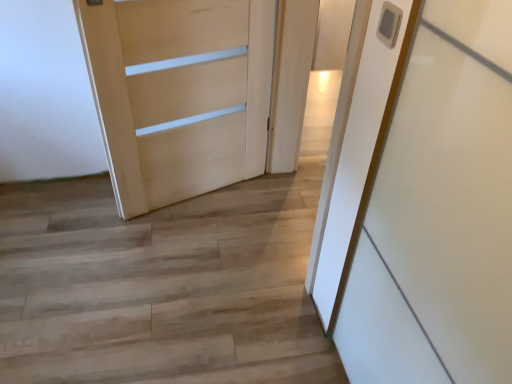
This screenshot has width=512, height=384. I want to click on free location above wooden floor at center (from a real-world perspective), so click(x=132, y=279).